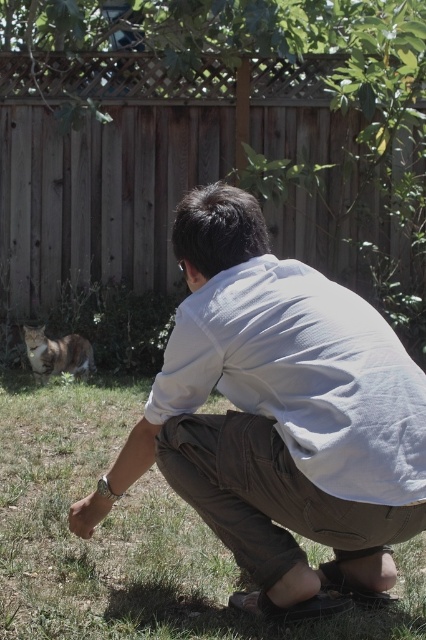
Can you confirm if white cotton shirt at center is positioned to the left of tabby fur cat at lower left?

Incorrect, white cotton shirt at center is not on the left side of tabby fur cat at lower left.

Which is behind, point (193, 282) or point (80, 372)?

The point (80, 372) is behind.

The image size is (426, 640). Find the location of `white cotton shirt at center`. white cotton shirt at center is located at coordinates (279, 413).

Where is `white cotton shirt at center`? The width and height of the screenshot is (426, 640). white cotton shirt at center is located at coordinates (279, 413).

Does white cotton shirt at center come in front of green grass at lower center?

Yes, white cotton shirt at center is in front of green grass at lower center.

Who is taller, white cotton shirt at center or green grass at lower center?

white cotton shirt at center is taller.

What do you see at coordinates (279, 413) in the screenshot? The height and width of the screenshot is (640, 426). I see `white cotton shirt at center` at bounding box center [279, 413].

The width and height of the screenshot is (426, 640). I want to click on white cotton shirt at center, so click(x=279, y=413).

Can you confirm if green grass at lower center is shorter than tabby fur cat at lower left?

In fact, green grass at lower center may be taller than tabby fur cat at lower left.

Is green grass at lower center taller than tabby fur cat at lower left?

Yes.

Does point (198, 604) come in front of point (89, 340)?

Yes, point (198, 604) is closer to viewer.

Identify the location of green grass at lower center. (131, 538).